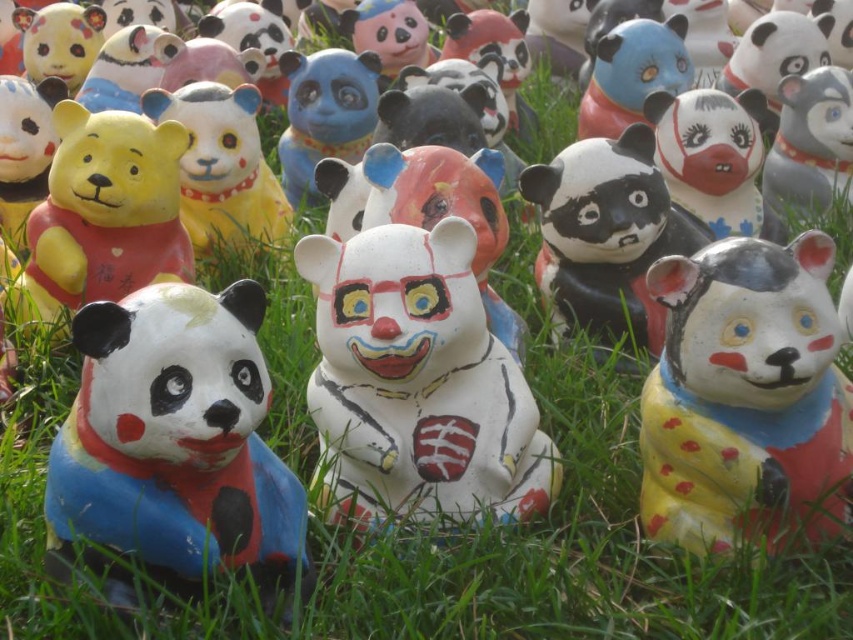
Image resolution: width=853 pixels, height=640 pixels. What do you see at coordinates (177, 440) in the screenshot?
I see `matte painted panda at lower left` at bounding box center [177, 440].

Looking at this image, does matte painted panda at lower left appear under white glossy panda at center?

Indeed, matte painted panda at lower left is positioned under white glossy panda at center.

The height and width of the screenshot is (640, 853). I want to click on matte painted panda at lower left, so click(177, 440).

Between white glossy panda at center and yellow matte bear at center, which one is positioned lower?

white glossy panda at center

Is white glossy panda at center further to camera compared to yellow matte bear at center?

No, it is in front of yellow matte bear at center.

Which is in front, point (561, 323) or point (234, 205)?

Point (561, 323) is more forward.

Identify the location of white glossy panda at center. (606, 236).

Consider the image. Does white matte clown bear at center appear under white glossy panda at center?

Indeed, white matte clown bear at center is positioned under white glossy panda at center.

This screenshot has height=640, width=853. Describe the element at coordinates (416, 384) in the screenshot. I see `white matte clown bear at center` at that location.

Locate an element on the screen. white matte clown bear at center is located at coordinates (416, 384).